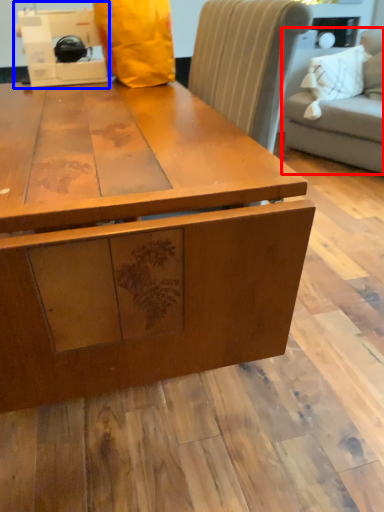
Question: Which point is closer to the camera, studio couch (highlighted by a red box) or sewing machine (highlighted by a blue box)?

Choices:
 (A) studio couch
 (B) sewing machine

Answer: (B)